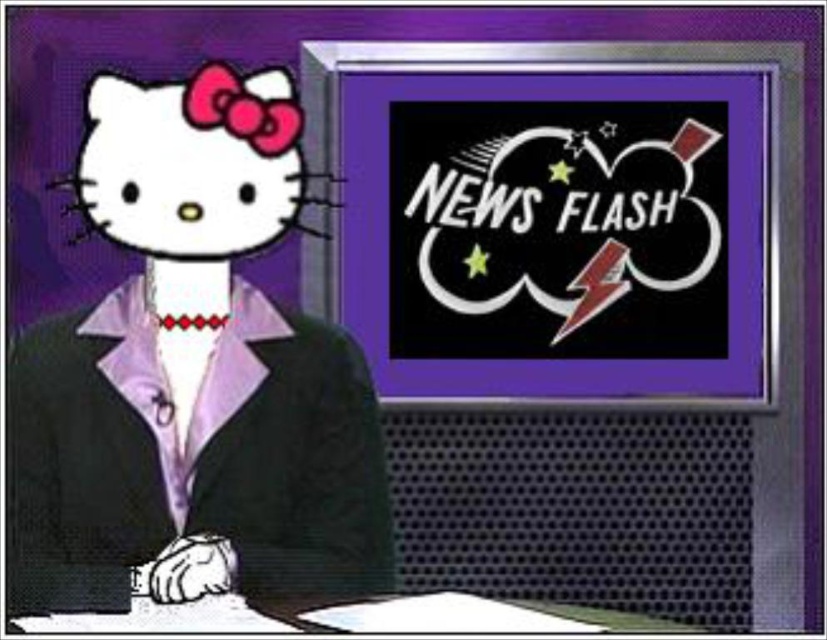
Question: Where is black glossy screen at upper right located in relation to black matte business suit at center in the image?

Choices:
 (A) left
 (B) right

Answer: (B)

Question: Can you confirm if black glossy screen at upper right is bigger than white matte hello kitty head at upper left?

Choices:
 (A) no
 (B) yes

Answer: (B)

Question: Which point appears farthest from the camera in this image?

Choices:
 (A) pyautogui.click(x=770, y=392)
 (B) pyautogui.click(x=498, y=608)

Answer: (A)

Question: Is black glossy screen at upper right thinner than white paper at lower center?

Choices:
 (A) yes
 (B) no

Answer: (B)

Question: Which point is farther to the camera?

Choices:
 (A) black matte business suit at center
 (B) white paper at lower center
 (C) white matte hello kitty head at upper left

Answer: (C)

Question: Estimate the real-world distances between objects in this image. Which object is farther from the black glossy screen at upper right?

Choices:
 (A) white paper at lower center
 (B) black matte business suit at center
 (C) white matte hello kitty head at upper left

Answer: (A)